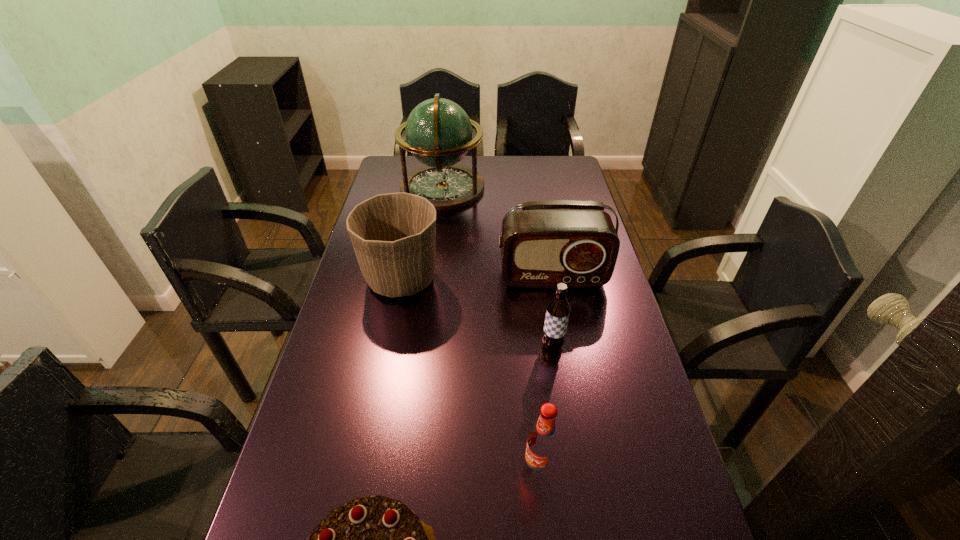
The width and height of the screenshot is (960, 540). Identify the location of vacant space at the right edge of the desktop. (559, 191).

Where is `free region at the far left corner`? free region at the far left corner is located at coordinates (385, 172).

In the image, there is a desktop. Where is `free space at the far right corner`? free space at the far right corner is located at coordinates (564, 159).

You are a GUI agent. You are given a task and a screenshot of the screen. Output one action in this format:
    pyautogui.click(x=<x>, y=<y>)
    Task: Click on the free space between the radio receiver and the flowerpot
    The image size is (960, 540).
    Given the screenshot: What is the action you would take?
    pyautogui.click(x=477, y=278)

This screenshot has width=960, height=540. I want to click on vacant region between the left root beer and the radio receiver, so click(x=545, y=373).

Locate an element on the screen. The image size is (960, 540). vacant area that lies between the nearer root beer and the radio receiver is located at coordinates (545, 373).

Find the location of a particular element. The height and width of the screenshot is (540, 960). free space between the farthest object and the second nearest object is located at coordinates (491, 328).

Find the location of a particular element. This screenshot has width=960, height=540. empty location between the flowerpot and the radio receiver is located at coordinates (477, 278).

Identify the location of free space between the flowerpot and the radio receiver. The height and width of the screenshot is (540, 960). click(477, 278).

Locate an element on the screen. Image resolution: width=960 pixels, height=540 pixels. free point between the farther root beer and the flowerpot is located at coordinates (477, 312).